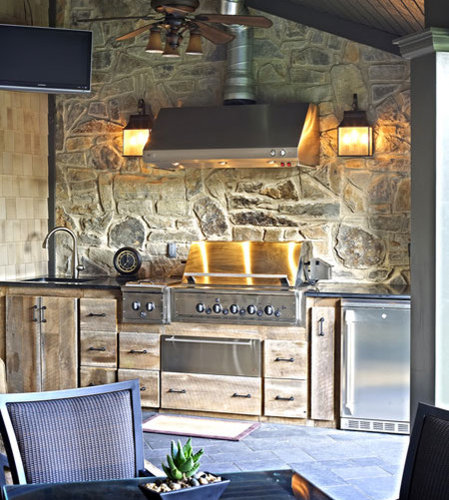
In order to click on mat in this screenshot , I will do (x=216, y=424).